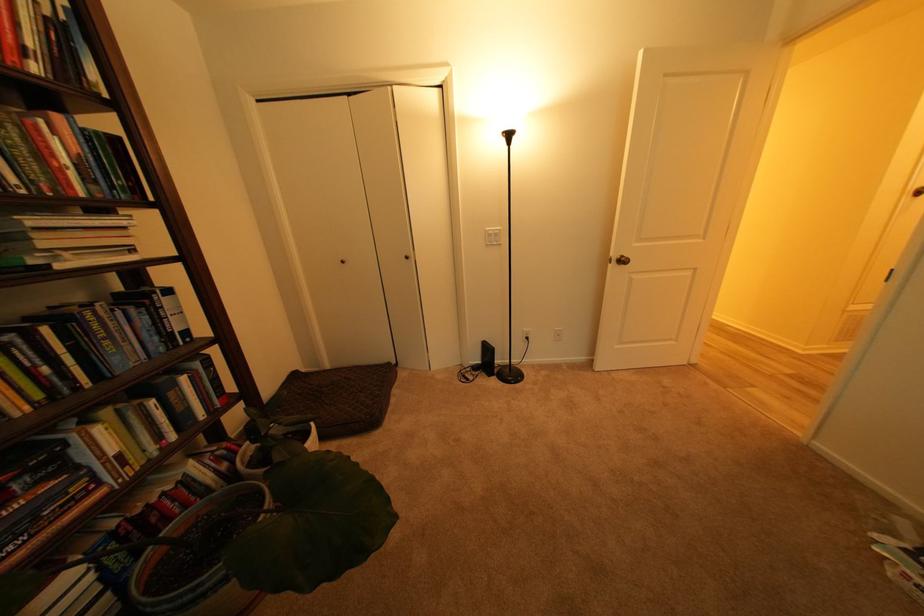
Locate an element on the screen. black electronic device is located at coordinates (485, 359).